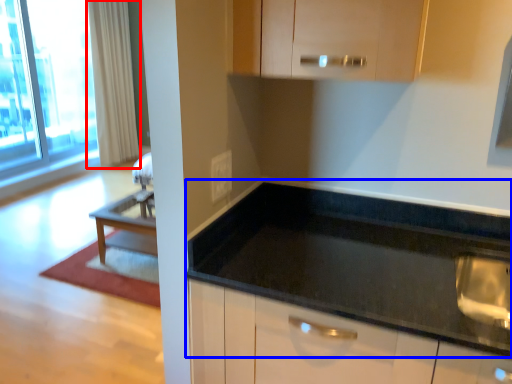
Question: Which object appears closest to the camera in this image, curtain (highlighted by a red box) or countertop (highlighted by a blue box)?

Choices:
 (A) curtain
 (B) countertop

Answer: (B)